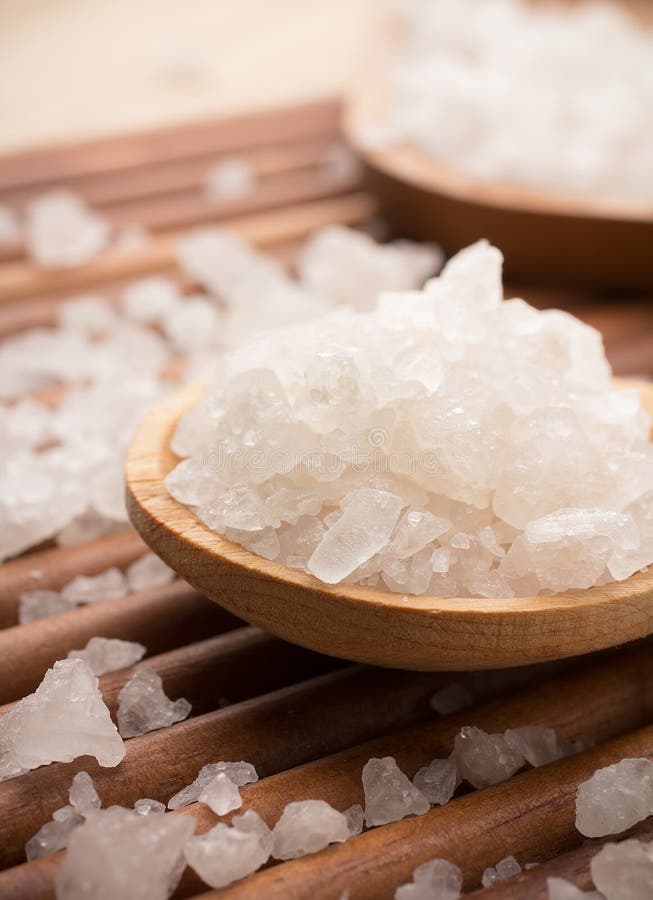
I want to click on front of wooden bowl, so click(452, 636).